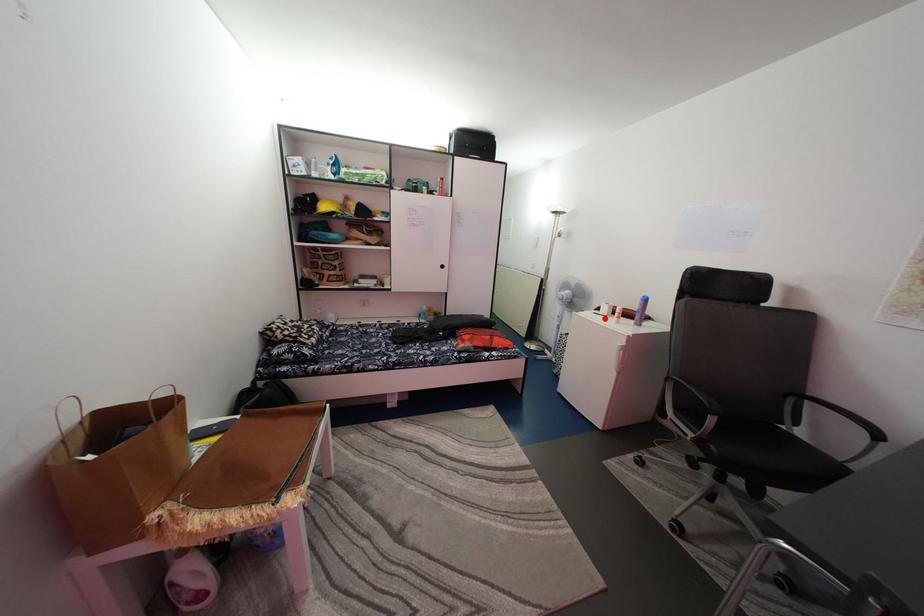
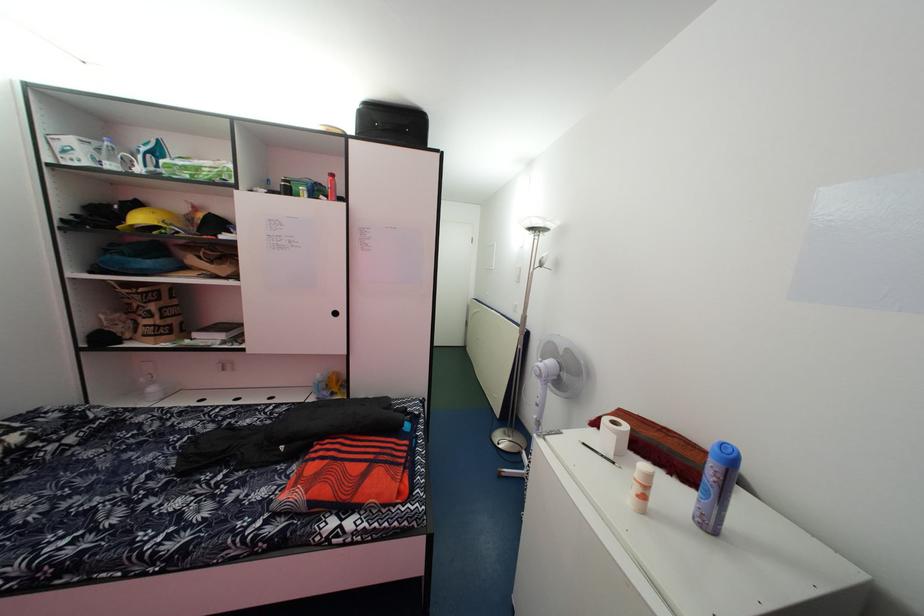
Locate, in the second image, the point that corresponds to the highlighted location in the first image.

(600, 442)